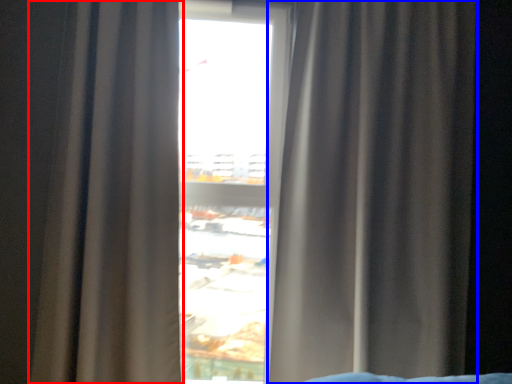
Question: Which point is closer to the camera, curtain (highlighted by a red box) or curtain (highlighted by a blue box)?

Choices:
 (A) curtain
 (B) curtain

Answer: (A)